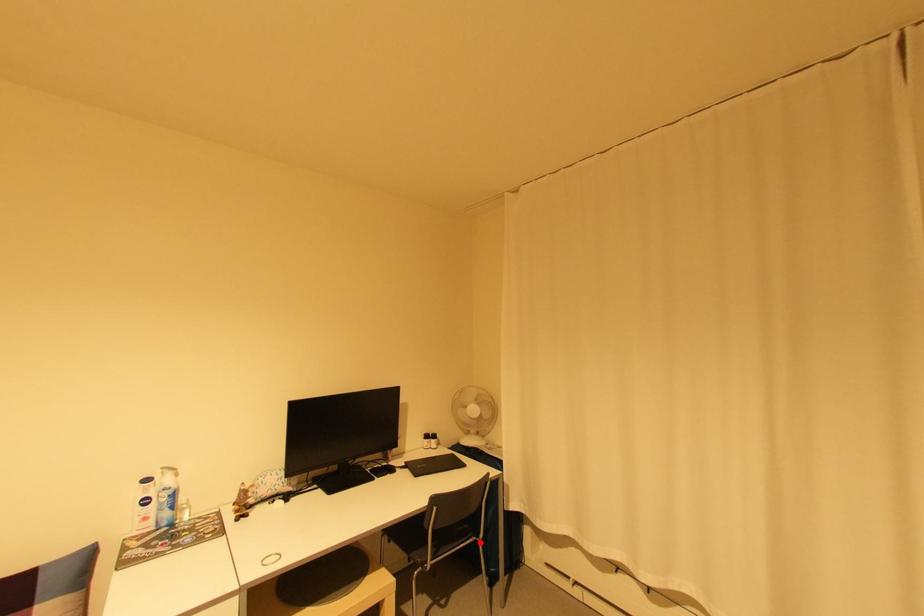
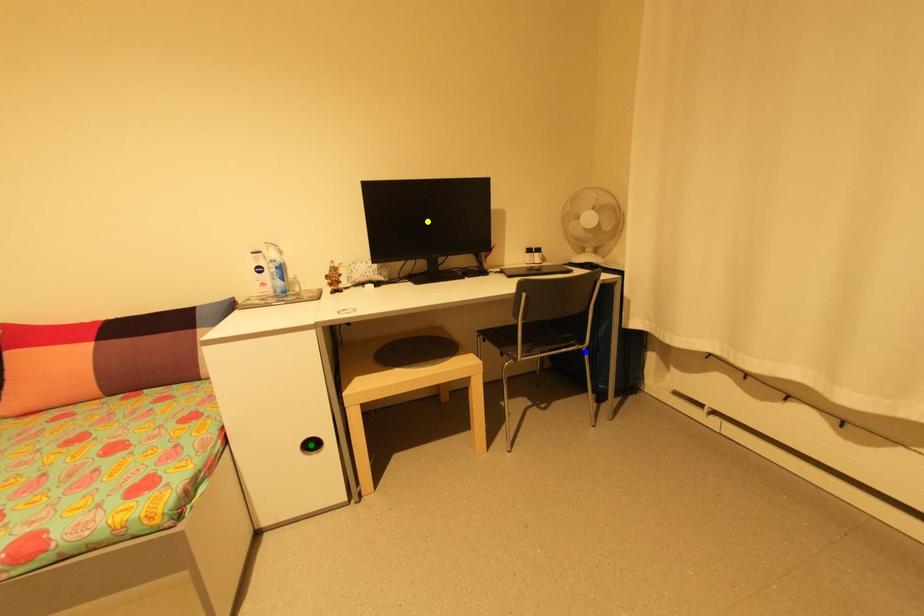
Question: I am providing you with two images of the same scene from different viewpoints. A red point is marked on the first image. You are given multiple points on the second image. Which point in image 2 represents the same 3d spot as the red point in image 1?

Choices:
 (A) green point
 (B) yellow point
 (C) blue point

Answer: (C)